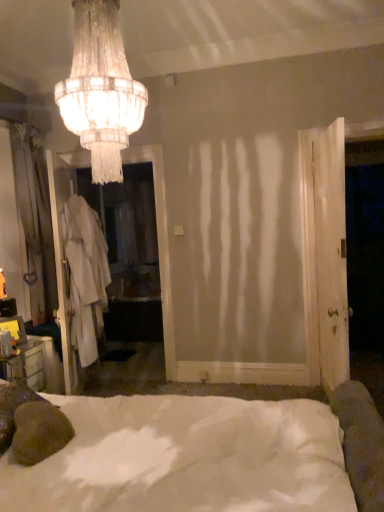
Question: Looking at the image, does white fabric screen door at left seem bigger or smaller compared to white soft bed at center?

Choices:
 (A) big
 (B) small

Answer: (B)

Question: Considering their positions, is white fabric screen door at left located in front of or behind white soft bed at center?

Choices:
 (A) front
 (B) behind

Answer: (B)

Question: Based on their relative distances, which object is farther from the white fabric robe at left?

Choices:
 (A) white soft bed at center
 (B) white wood door at right
 (C) white fabric screen door at left
 (D) crystal glass chandelier at upper center

Answer: (B)

Question: Which is nearer to the white fabric robe at left?

Choices:
 (A) white soft bed at center
 (B) white fabric screen door at left
 (C) crystal glass chandelier at upper center
 (D) white wood door at right

Answer: (B)